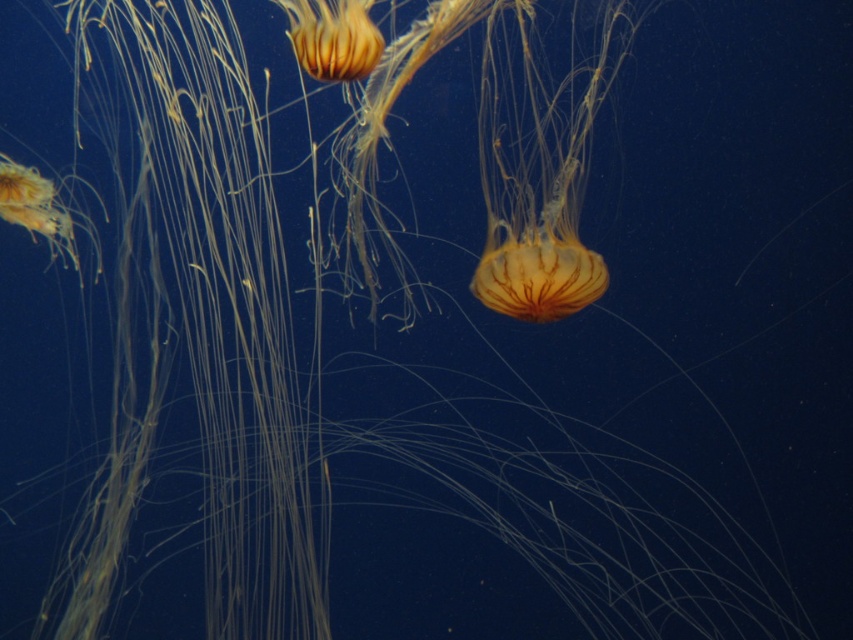
You are a marine biologist observing two translucent orange jellyfish in a dimly lit underwater environment. You notice one is at the center and the other at the upper center. Given that your underwater camera has a 10 inch focal range, can you capture both translucent orange jellyfish at center and translucent orange jellyfish at upper center in a single photo?

The distance between the translucent orange jellyfish at center and the translucent orange jellyfish at upper center is 11.63 inches. Since the camera has a 10 inch focal range, it cannot capture both in a single photo as the required distance exceeds the focal range.